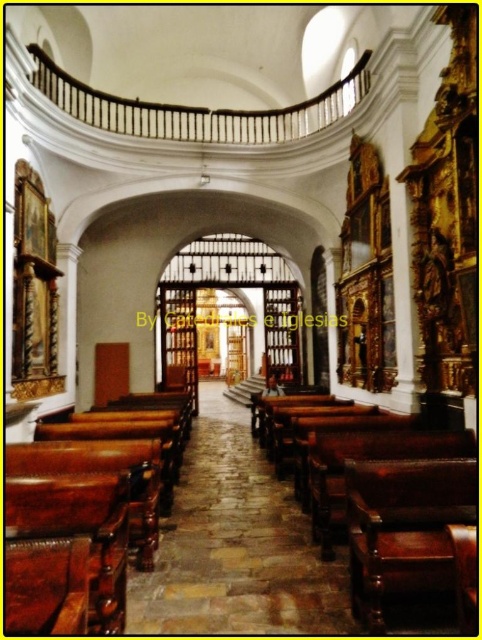
Can you confirm if brown leather bench at lower left is wider than polished dark wood bench at center?

In fact, brown leather bench at lower left might be narrower than polished dark wood bench at center.

Is the position of brown leather bench at lower left less distant than that of polished dark wood bench at center?

Yes.

The image size is (482, 640). In order to click on brown leather bench at lower left in this screenshot , I will do `click(80, 518)`.